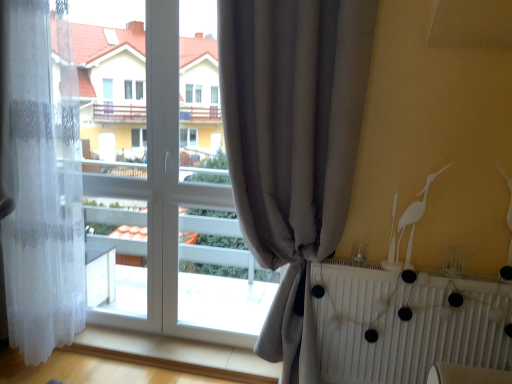
Identify the location of vacant area on top of white matte radiator at lower right (from a real-world perspective). (422, 270).